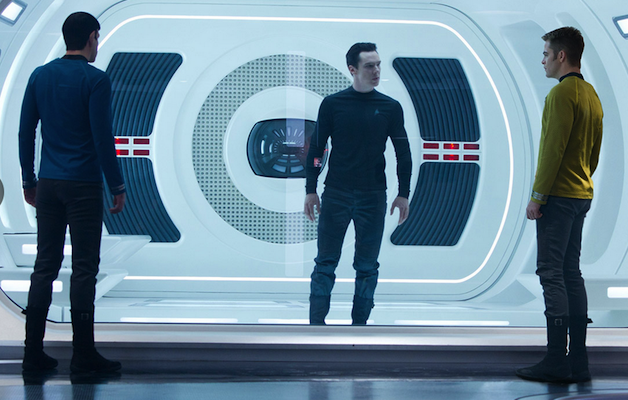
Locate an element on the screen. The height and width of the screenshot is (400, 628). chest is located at coordinates (350, 114).